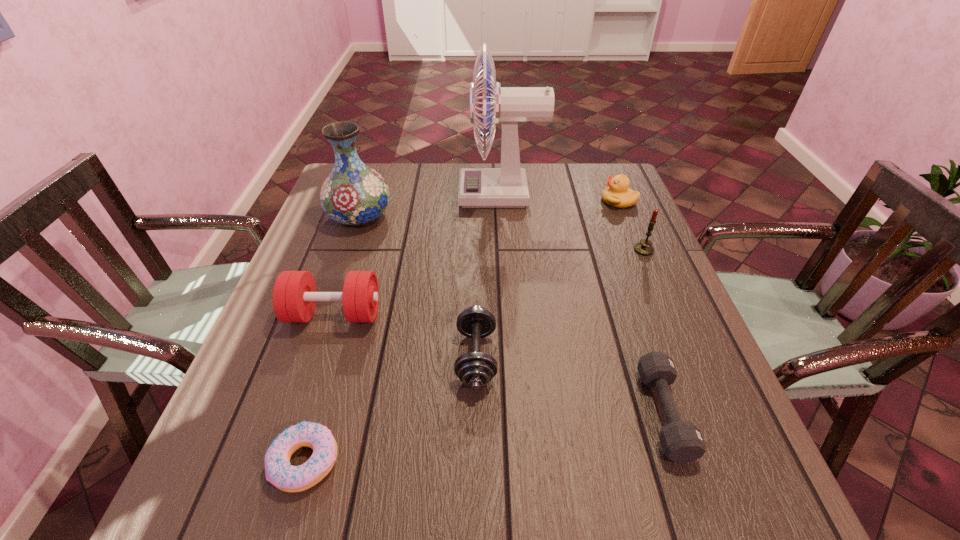
Locate an element on the screen. The height and width of the screenshot is (540, 960). free space located on the back of the shortest object is located at coordinates (342, 338).

In order to click on fan that is at the far edge in this screenshot , I will do `click(506, 186)`.

This screenshot has height=540, width=960. Find the location of `vase located at the far edge`. vase located at the far edge is located at coordinates (353, 194).

This screenshot has height=540, width=960. Find the location of `duckling present at the far edge`. duckling present at the far edge is located at coordinates (618, 194).

This screenshot has width=960, height=540. Find the location of `object that is at the near edge`. object that is at the near edge is located at coordinates (278, 470).

At what (x,y) coordinates should I click in order to perform the action: click on vase present at the left edge. Please return your answer as a coordinate pair (x, y). Looking at the image, I should click on click(x=353, y=194).

Locate an element on the screen. dumbbell situated at the left edge is located at coordinates (294, 294).

At what (x,y) coordinates should I click in order to perform the action: click on doughnut positioned at the left edge. Please return your answer as a coordinate pair (x, y). Looking at the image, I should click on (278, 470).

I want to click on candle that is at the right edge, so click(644, 247).

Image resolution: width=960 pixels, height=540 pixels. Find the location of `duckling present at the right edge`. duckling present at the right edge is located at coordinates (618, 194).